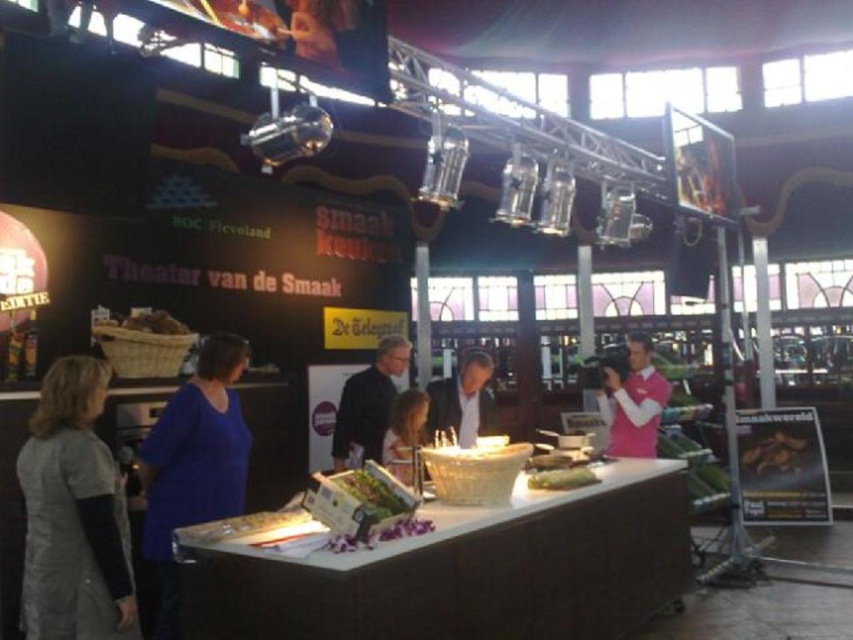
Question: Does white glossy buffet at center appear over pink jersey at right?

Choices:
 (A) yes
 (B) no

Answer: (B)

Question: Is dark gray suit at center thinner than light brown hair at center?

Choices:
 (A) yes
 (B) no

Answer: (B)

Question: Is gray fabric dress at left positioned behind green leafy vegetable at center?

Choices:
 (A) yes
 (B) no

Answer: (B)

Question: Which of the following is the closest to the observer?

Choices:
 (A) dark brown leather jacket at center
 (B) green leafy vegetables at center

Answer: (B)

Question: Which point is farther to the camera?

Choices:
 (A) brown matte bread at lower right
 (B) blue fabric shirt at left
 (C) pink jersey at right

Answer: (A)

Question: Which is nearer to the brown matte bread at lower right?

Choices:
 (A) green leafy vegetables at center
 (B) light brown hair at center
 (C) gray fabric dress at left
 (D) green leafy vegetable at center

Answer: (D)